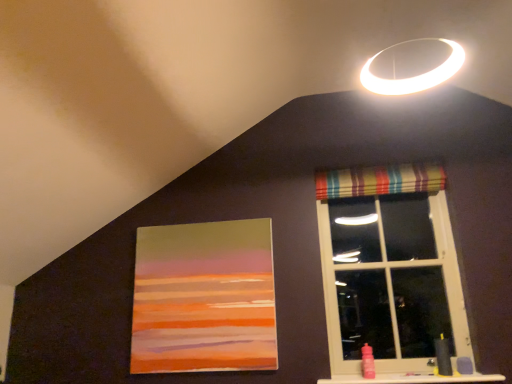
Identify the location of matte acrylic painting at center. The width and height of the screenshot is (512, 384). (204, 298).

Locate an element on the screen. The image size is (512, 384). smooth plastic bottle at lower right is located at coordinates (413, 379).

This screenshot has height=384, width=512. Describe the element at coordinates (390, 281) in the screenshot. I see `striped fabric window at upper right` at that location.

You are a GUI agent. You are given a task and a screenshot of the screen. Output one action in this format:
    pyautogui.click(x=<x>, y=<y>)
    Task: Click on the yellow rubber sink at lower right
    Image resolution: width=512 pixels, height=384 pixels.
    Given the screenshot: What is the action you would take?
    pyautogui.click(x=443, y=357)

Where is `striped fabric curtain at upper right`? The width and height of the screenshot is (512, 384). striped fabric curtain at upper right is located at coordinates (379, 180).

Would you say yellow rubber sink at lower right is a long distance from smooth plastic bottle at lower right?

yellow rubber sink at lower right is near smooth plastic bottle at lower right, not far away.

From a real-world perspective, relative to smooth plastic bottle at lower right, is yellow rubber sink at lower right vertically above or below?

yellow rubber sink at lower right is situated higher than smooth plastic bottle at lower right in the real world.

Can you confirm if yellow rubber sink at lower right is taller than smooth plastic bottle at lower right?

Indeed, yellow rubber sink at lower right has a greater height compared to smooth plastic bottle at lower right.

From the picture: Which is more to the left, yellow rubber sink at lower right or smooth plastic bottle at lower right?

smooth plastic bottle at lower right is more to the left.

Looking at this image, is matte acrylic painting at center at the back of striped fabric curtain at upper right?

striped fabric curtain at upper right is not turned away from matte acrylic painting at center.

How many degrees apart are the facing directions of striped fabric curtain at upper right and matte acrylic painting at center?

The facing directions of striped fabric curtain at upper right and matte acrylic painting at center are 0.649 degrees apart.

Considering the relative sizes of striped fabric curtain at upper right and matte acrylic painting at center in the image provided, is striped fabric curtain at upper right smaller than matte acrylic painting at center?

Yes.

Which is nearer, (419, 174) or (234, 329)?

Point (419, 174) is farther from the camera than point (234, 329).

Does matte acrylic painting at center turn towards smooth plastic bottle at lower right?

No, matte acrylic painting at center does not turn towards smooth plastic bottle at lower right.

Consider the image. Considering the relative positions of matte acrylic painting at center and smooth plastic bottle at lower right in the image provided, is matte acrylic painting at center to the left or to the right of smooth plastic bottle at lower right?

Clearly, matte acrylic painting at center is on the left of smooth plastic bottle at lower right in the image.

Does point (250, 317) appear closer or farther from the camera than point (450, 381)?

Point (250, 317).

From the image's perspective, is matte acrylic painting at center positioned above or below smooth plastic bottle at lower right?

matte acrylic painting at center is situated higher than smooth plastic bottle at lower right in the image.

Can you confirm if striped fabric window at upper right is shorter than striped fabric curtain at upper right?

Incorrect, the height of striped fabric window at upper right does not fall short of that of striped fabric curtain at upper right.

From the picture: Which object is thinner, striped fabric window at upper right or striped fabric curtain at upper right?

striped fabric curtain at upper right is thinner.

Between striped fabric window at upper right and striped fabric curtain at upper right, which one appears on the right side from the viewer's perspective?

From the viewer's perspective, striped fabric window at upper right appears more on the right side.

Which point is more distant from viewer, [413,292] or [403,177]?

The point [403,177] is behind.

Which object is wider, matte acrylic painting at center or striped fabric window at upper right?

With larger width is striped fabric window at upper right.

Can you confirm if matte acrylic painting at center is positioned to the right of striped fabric window at upper right?

In fact, matte acrylic painting at center is to the left of striped fabric window at upper right.

From the picture: Is there a large distance between matte acrylic painting at center and striped fabric window at upper right?

No, matte acrylic painting at center is not far away from striped fabric window at upper right.

At what (x,y) coordinates should I click in order to perform the action: click on picture frame behind the striped fabric window at upper right. Please return your answer as a coordinate pair (x, y). Image resolution: width=512 pixels, height=384 pixels. Looking at the image, I should click on (204, 298).

Considering the relative sizes of striped fabric window at upper right and smooth plastic bottle at lower right in the image provided, is striped fabric window at upper right thinner than smooth plastic bottle at lower right?

Yes.

Could you tell me if striped fabric window at upper right is turned towards smooth plastic bottle at lower right?

Yes, striped fabric window at upper right is facing smooth plastic bottle at lower right.

Does striped fabric window at upper right appear on the left side of smooth plastic bottle at lower right?

In fact, striped fabric window at upper right is to the right of smooth plastic bottle at lower right.

At what (x,y) coordinates should I click in order to perform the action: click on window on the right of the smooth plastic bottle at lower right. Please return your answer as a coordinate pair (x, y). This screenshot has height=384, width=512. Looking at the image, I should click on (390, 281).

Could you tell me if smooth plastic bottle at lower right is turned towards striped fabric curtain at upper right?

No, smooth plastic bottle at lower right is not oriented towards striped fabric curtain at upper right.

Considering the sizes of smooth plastic bottle at lower right and striped fabric curtain at upper right in the image, is smooth plastic bottle at lower right taller or shorter than striped fabric curtain at upper right?

Considering their sizes, smooth plastic bottle at lower right has less height than striped fabric curtain at upper right.

From the image's perspective, is smooth plastic bottle at lower right on striped fabric curtain at upper right?

No.

Measure the distance from smooth plastic bottle at lower right to striped fabric curtain at upper right.

smooth plastic bottle at lower right is 4.31 feet from striped fabric curtain at upper right.

Where is `sink that is above the smooth plastic bottle at lower right (from a real-world perspective)`? Image resolution: width=512 pixels, height=384 pixels. sink that is above the smooth plastic bottle at lower right (from a real-world perspective) is located at coordinates (443, 357).

You are a GUI agent. You are given a task and a screenshot of the screen. Output one action in this format:
    pyautogui.click(x=<x>, y=<y>)
    Task: Click on the picture frame below the striped fabric curtain at upper right (from a real-world perspective)
    The image size is (512, 384).
    Given the screenshot: What is the action you would take?
    pyautogui.click(x=204, y=298)

From the image, which object appears to be nearer to yellow rubber sink at lower right, striped fabric window at upper right or matte acrylic painting at center?

striped fabric window at upper right.

Which object lies further to the anchor point yellow rubber sink at lower right, striped fabric curtain at upper right or matte acrylic painting at center?

matte acrylic painting at center lies further to yellow rubber sink at lower right than the other object.

From the image, which object appears to be farther from matte acrylic painting at center, smooth plastic bottle at lower right or striped fabric window at upper right?

Based on the image, smooth plastic bottle at lower right appears to be further to matte acrylic painting at center.

When comparing their distances from striped fabric curtain at upper right, does matte acrylic painting at center or yellow rubber sink at lower right seem further?

yellow rubber sink at lower right is further to striped fabric curtain at upper right.

Estimate the real-world distances between objects in this image. Which object is further from striped fabric curtain at upper right, matte acrylic painting at center or smooth plastic bottle at lower right?

smooth plastic bottle at lower right.

Which object lies further to the anchor point striped fabric curtain at upper right, yellow rubber sink at lower right or smooth plastic bottle at lower right?

smooth plastic bottle at lower right lies further to striped fabric curtain at upper right than the other object.

Considering their positions, is smooth plastic bottle at lower right positioned further to striped fabric curtain at upper right than matte acrylic painting at center?

The object further to striped fabric curtain at upper right is smooth plastic bottle at lower right.

Which object lies further to the anchor point striped fabric curtain at upper right, striped fabric window at upper right or matte acrylic painting at center?

matte acrylic painting at center is further to striped fabric curtain at upper right.

Identify the location of window between striped fabric curtain at upper right and smooth plastic bottle at lower right in the up-down direction. Image resolution: width=512 pixels, height=384 pixels. (390, 281).

Identify the location of window between striped fabric curtain at upper right and yellow rubber sink at lower right in the up-down direction. click(x=390, y=281).

What are the coordinates of `window located between matte acrylic painting at center and yellow rubber sink at lower right in the left-right direction` in the screenshot? It's located at (390, 281).

In order to click on sink between striped fabric window at upper right and smooth plastic bottle at lower right from top to bottom in this screenshot , I will do `click(443, 357)`.